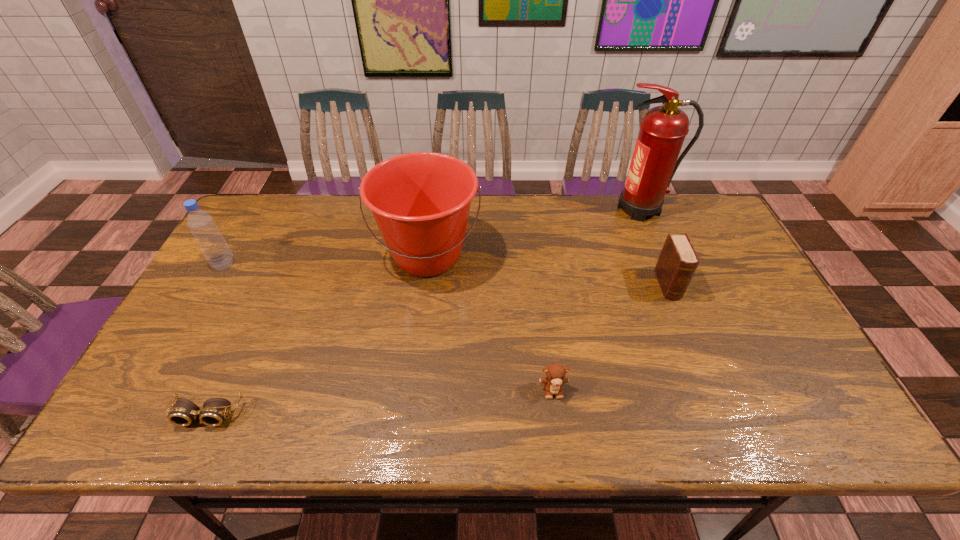
Locate an element on the screen. object that is the fourth nearest to the fourth shortest object is located at coordinates (663, 129).

Select which object appears as the third closest to the leftmost object. Please provide its 2D coordinates. Your answer should be formatted as a tuple, i.e. [(x, y)], where the tuple contains the x and y coordinates of a point satisfying the conditions above.

[(555, 373)]

Locate an element on the screen. The image size is (960, 540). free space that satisfies the following two spatial constraints: 1. on the front-facing side of the tallest object; 2. on the spine side of the diary is located at coordinates (673, 286).